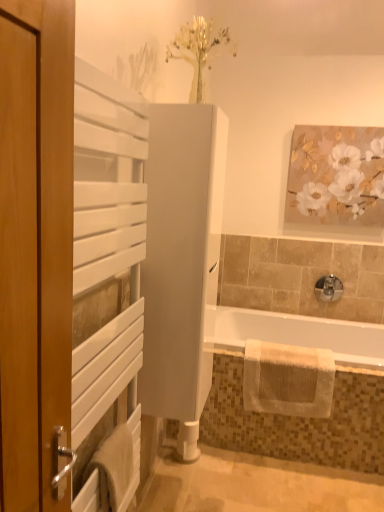
Question: Is white matte cabinet at center, which is the second screen door in front-to-back order, wider or thinner than white textured towel at lower left, the 2th bath towel in the right-to-left sequence?

Choices:
 (A) thin
 (B) wide

Answer: (B)

Question: From a real-world perspective, is white matte cabinet at center, acting as the 1th screen door starting from the back, above or below white textured towel at lower left, the 2th bath towel when ordered from back to front?

Choices:
 (A) above
 (B) below

Answer: (A)

Question: Estimate the real-world distances between objects in this image. Which object is farther from the satin nickel faucet at lower right?

Choices:
 (A) white glossy bathtub at lower center
 (B) white textured towel at lower right, placed as the 1th bath towel when sorted from back to front
 (C) white glossy tub at lower right
 (D) white matte cabinet at center, which is the second screen door in front-to-back order
 (E) gold textured canvas at upper right

Answer: (D)

Question: Considering the real-world distances, which object is farthest from the satin nickel faucet at lower right?

Choices:
 (A) white textured towel at lower left, which ranks as the 1th bath towel in left-to-right order
 (B) white textured towel at lower right, placed as the 2th bath towel when sorted from front to back
 (C) gold textured canvas at upper right
 (D) white glossy tub at lower right
 (E) white glossy bathtub at lower center

Answer: (A)